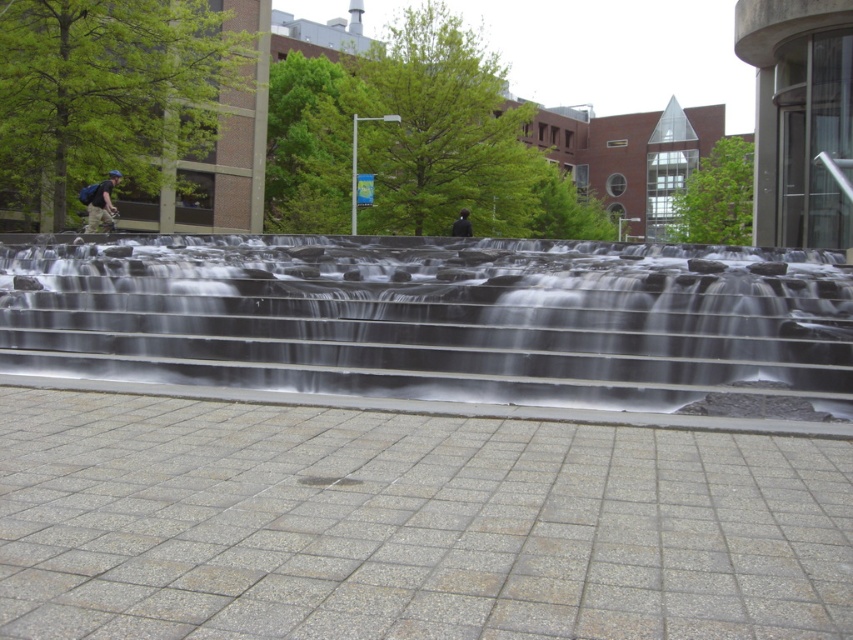
You are standing in the urban landscape and want to walk to the point marked at coordinates (x=439, y=317). According to the scene description, where exactly is this point located?

The point at coordinates (x=439, y=317) is located on the clear glass water at center.

You are standing in the urban landscape and want to take a photo of the clear glass water at center. If your camera can focus on objects up to 5 meters away, will you need to move closer?

The clear glass water at center is 7.05 meters from the viewer, which is beyond the camera focus range of 5 meters. You need to move closer to ensure proper focus.

You are standing at the edge of the paved area and want to cross to the other side. There is a clear glass water at center and a dark blue fabric jacket at center in your path. Which object do you need to step over or around due to its size?

The clear glass water at center has a larger size compared to the dark blue fabric jacket at center, so you need to step over or around the clear glass water at center.